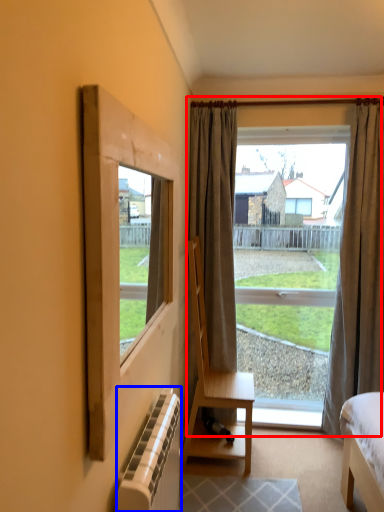
Question: Which object appears farthest to the camera in this image, window (highlighted by a red box) or radiator (highlighted by a blue box)?

Choices:
 (A) window
 (B) radiator

Answer: (A)